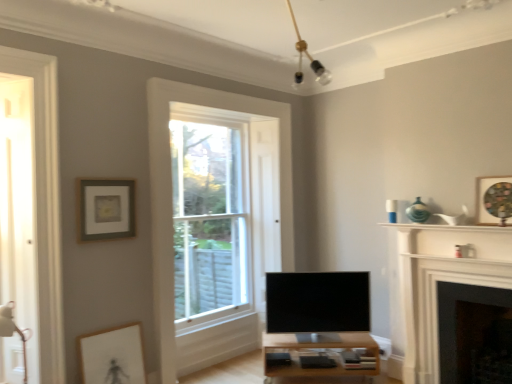
The width and height of the screenshot is (512, 384). Identify the location of free spot above white wood fireplace at right, the 2th fireplace positioned from the right (from a real-world perspective). click(x=454, y=232).